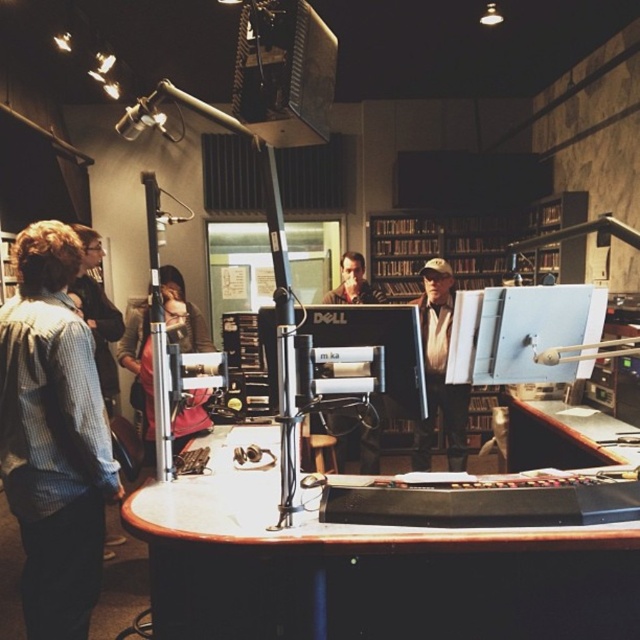
Question: Does white glossy table at center appear under matte black monitor at center?

Choices:
 (A) no
 (B) yes

Answer: (B)

Question: Is light brown leather jacket at center thinner than brown wood table at lower right?

Choices:
 (A) no
 (B) yes

Answer: (A)

Question: Which object is closer to the camera taking this photo?

Choices:
 (A) blue plaid shirt at left
 (B) matte black monitor at center

Answer: (A)

Question: Which point is farther to the camera?

Choices:
 (A) (61, 394)
 (B) (348, 269)
 (C) (376, 268)
 (D) (541, 436)

Answer: (C)

Question: Which object appears closest to the camera in this image?

Choices:
 (A) wooden bookshelf at center
 (B) light brown leather jacket at center
 (C) white glossy table at center

Answer: (C)

Question: Considering the relative positions of wooden bookshelf at center and khaki cotton cap at center in the image provided, where is wooden bookshelf at center located with respect to khaki cotton cap at center?

Choices:
 (A) below
 (B) above

Answer: (B)